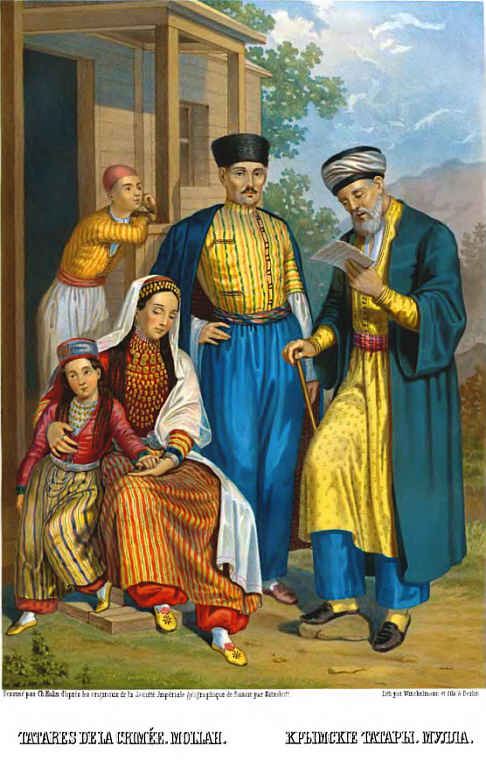
I want to click on handle, so click(150, 475).